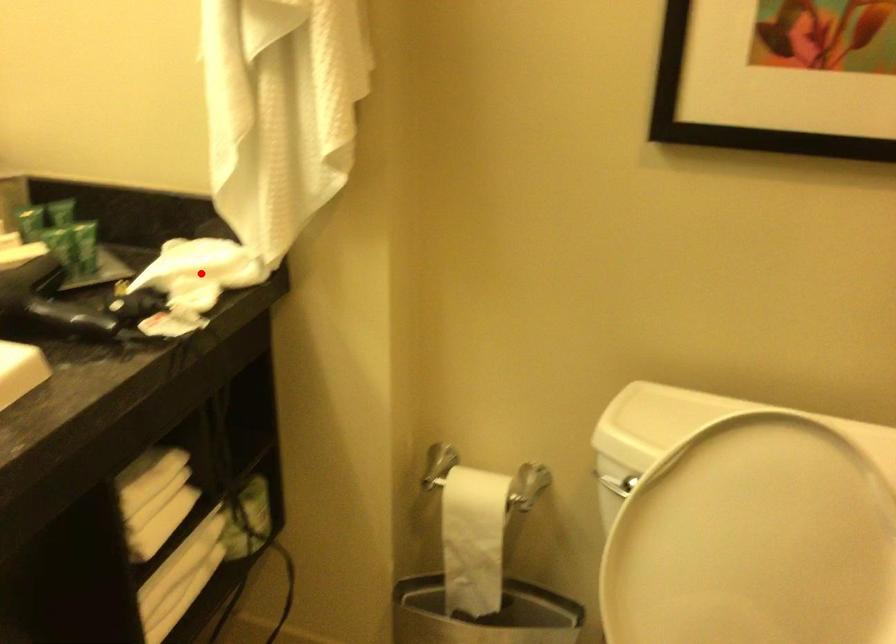
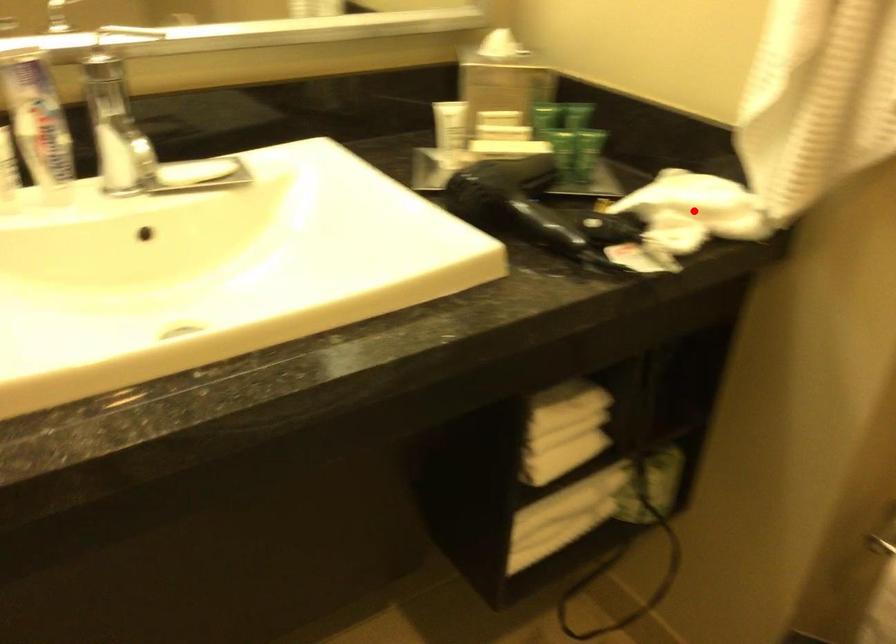
I am providing you with two images of the same scene from different viewpoints. A red point is marked on the first image and another point is marked on the second image. Are the points marked in image1 and image2 representing the same 3D position?

Yes